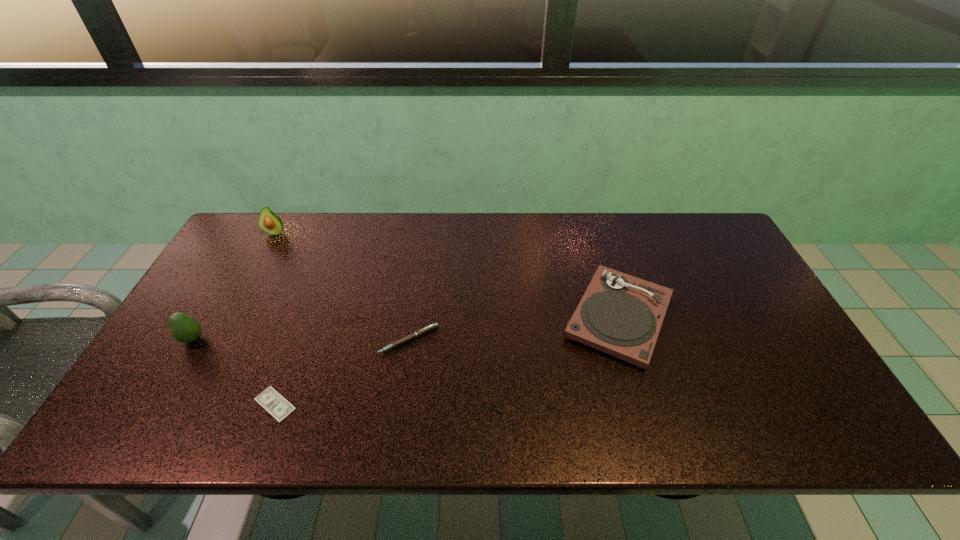
Locate an element on the screen. vacant space at the right edge of the desktop is located at coordinates (725, 267).

Locate an element on the screen. The width and height of the screenshot is (960, 540). free space between the pen and the phonograph_record is located at coordinates (515, 328).

Find the location of a particular element. free space between the shorter avocado and the second object from right to left is located at coordinates (301, 340).

Where is `free area in between the third object from left to right and the farther avocado`? The width and height of the screenshot is (960, 540). free area in between the third object from left to right and the farther avocado is located at coordinates pos(276,318).

Locate an element on the screen. vacant point located between the second tallest object and the shortest object is located at coordinates (234, 372).

At what (x,y) coordinates should I click in order to perform the action: click on free space between the phonograph_record and the shorter avocado. Please return your answer as a coordinate pair (x, y). Image resolution: width=960 pixels, height=540 pixels. Looking at the image, I should click on (406, 328).

Locate an element on the screen. unoccupied position between the second object from right to left and the farthest object is located at coordinates (343, 286).

Locate an element on the screen. Image resolution: width=960 pixels, height=540 pixels. empty space that is in between the second tallest object and the farther avocado is located at coordinates (234, 286).

I want to click on free spot between the pen and the third object from right to left, so click(x=342, y=372).

At what (x,y) coordinates should I click in order to perform the action: click on vacant space that's between the fourth shortest object and the fourth object from left to right. Please return your answer as a coordinate pair (x, y). The height and width of the screenshot is (540, 960). Looking at the image, I should click on (301, 340).